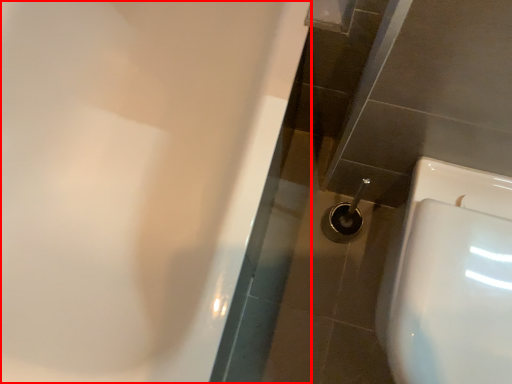
Question: Observing the image, what is the correct spatial positioning of bath (annotated by the red box) in reference to toilet?

Choices:
 (A) right
 (B) left

Answer: (B)